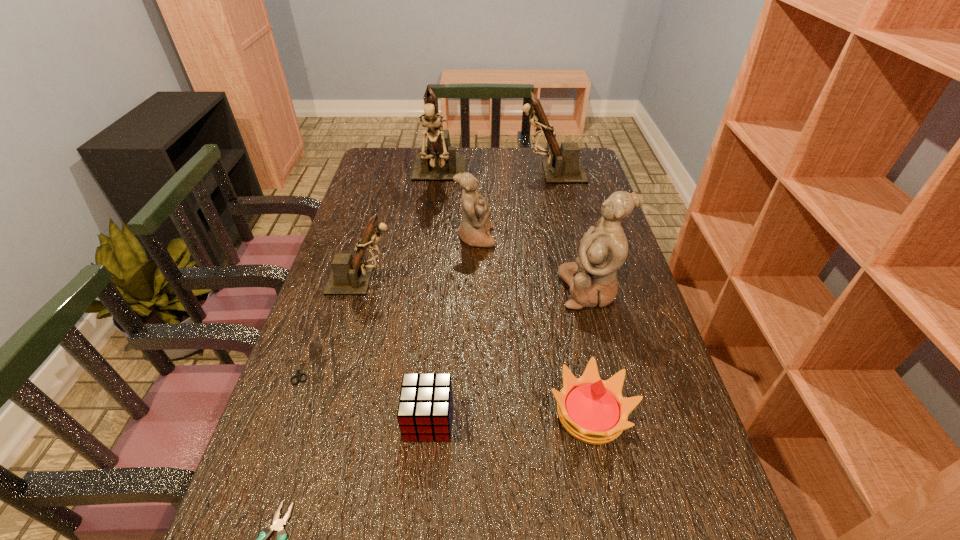
Locate an element on the screen. cube is located at coordinates (425, 406).

The height and width of the screenshot is (540, 960). I want to click on red cube, so click(x=425, y=406).

Image resolution: width=960 pixels, height=540 pixels. I want to click on shears, so 298,375.

The width and height of the screenshot is (960, 540). I want to click on black shears, so click(298, 375).

Where is `free space located on the front-facing side of the biggest brown figurine`? The height and width of the screenshot is (540, 960). free space located on the front-facing side of the biggest brown figurine is located at coordinates (430, 241).

Image resolution: width=960 pixels, height=540 pixels. Identify the location of vacant area located on the front-facing side of the rightmost brown figurine. (438, 172).

Image resolution: width=960 pixels, height=540 pixels. In order to click on vacant space located on the front-facing side of the rightmost brown figurine in this screenshot , I will do `click(494, 172)`.

Identify the location of free region located on the front-facing side of the rightmost brown figurine. coord(475,172).

Identify the location of vacant space located 0.200m on the front-facing side of the right white figurine. (486, 290).

I want to click on vacant space located 0.360m on the front-facing side of the right white figurine, so click(x=426, y=290).